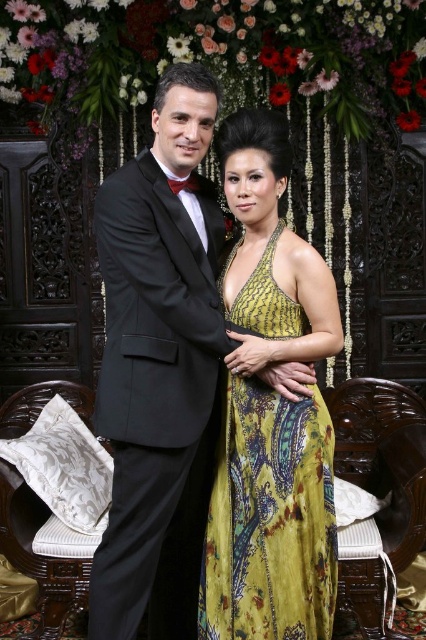
Based on the photo, which is below, black satin tuxedo at left or yellow printed fabric dress at center?

yellow printed fabric dress at center

Can you confirm if black satin tuxedo at left is wider than yellow printed fabric dress at center?

Yes.

Identify the location of black satin tuxedo at left. Image resolution: width=426 pixels, height=640 pixels. (157, 397).

In order to click on black satin tuxedo at left in this screenshot , I will do `click(157, 397)`.

The height and width of the screenshot is (640, 426). What do you see at coordinates (253, 186) in the screenshot? I see `shiny black suit at left` at bounding box center [253, 186].

Is point (129, 536) closer to viewer compared to point (290, 561)?

Yes.

The image size is (426, 640). In order to click on shiny black suit at left in this screenshot , I will do `click(253, 186)`.

Can you confirm if black satin tuxedo at left is positioned above shiny black suit at left?

No.

Locate an element on the screen. Image resolution: width=426 pixels, height=640 pixels. black satin tuxedo at left is located at coordinates (157, 397).